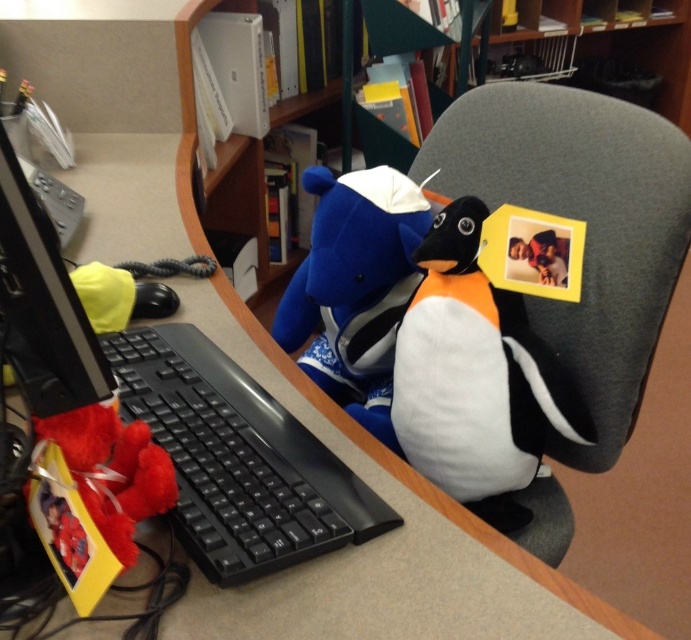
Question: Among these objects, which one is nearest to the camera?

Choices:
 (A) blue plush bear at center
 (B) matte black monitor at left
 (C) wooden bookshelf at center

Answer: (B)

Question: Is wooden bookshelf at center smaller than matte black monitor at left?

Choices:
 (A) yes
 (B) no

Answer: (B)

Question: Which object appears closest to the camera in this image?

Choices:
 (A) blue plush bear at center
 (B) white plush penguin at right
 (C) wooden bookshelf at center
 (D) black plastic keyboard at lower left

Answer: (D)

Question: From the image, what is the correct spatial relationship of wooden bookshelf at center in relation to matte black monitor at left?

Choices:
 (A) below
 (B) above

Answer: (B)

Question: Which of the following is the closest to the observer?

Choices:
 (A) blue plush bear at center
 (B) black plastic keyboard at lower left
 (C) white plush penguin at right
 (D) wooden bookshelf at center

Answer: (B)

Question: Can you confirm if black plastic keyboard at lower left is positioned to the left of matte black monitor at left?

Choices:
 (A) yes
 (B) no

Answer: (B)